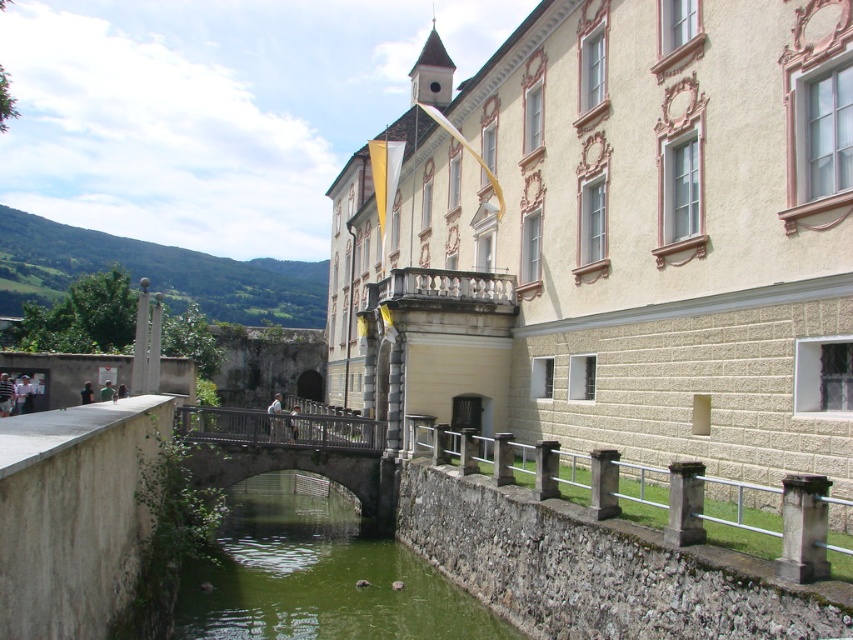
You are a tourist standing on the wooden bridge at center and want to take a photo of the green stone river at center. Which direction should you face to capture the river in your shot?

The green stone river at center is positioned on the right side of wooden bridge at center, so you should face to the right to capture the river in your shot.